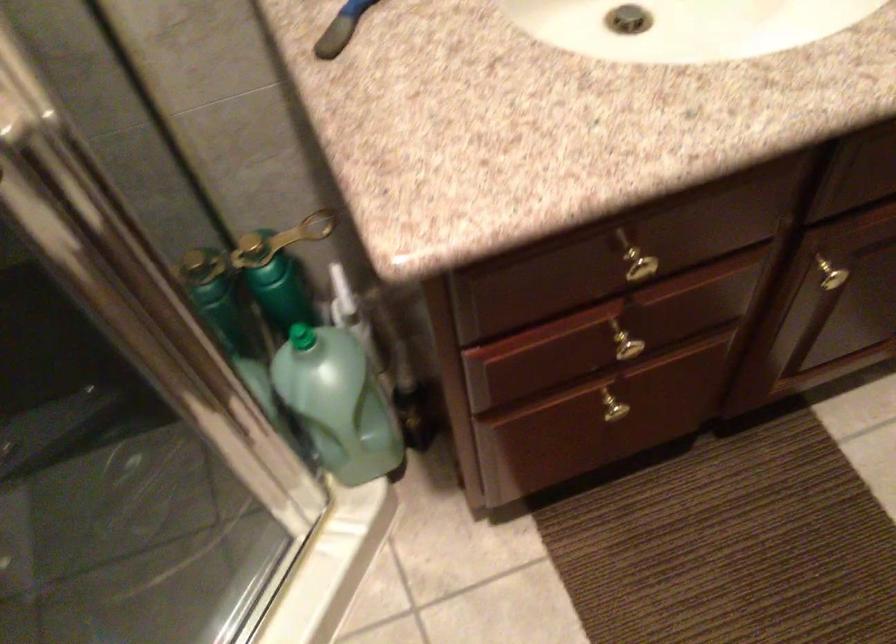
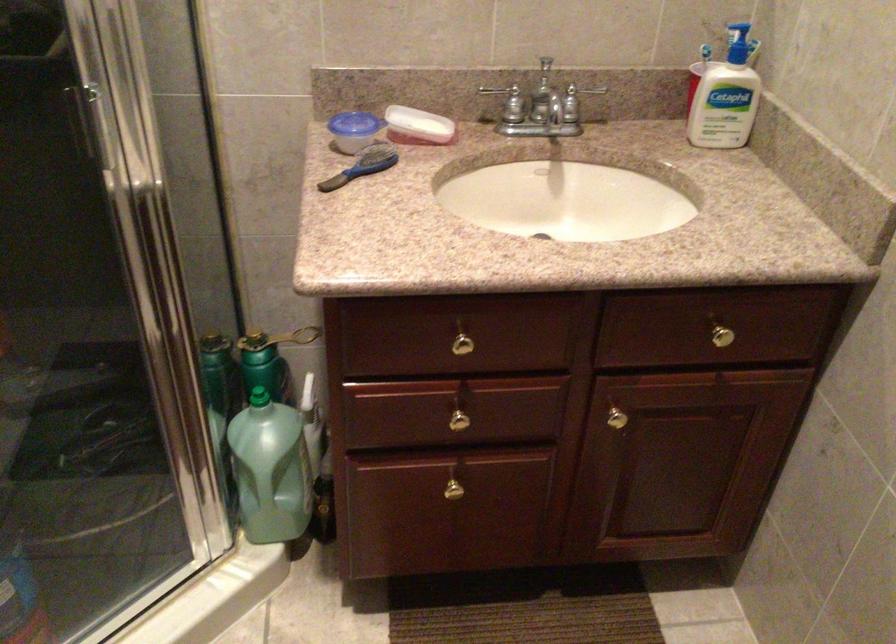
In the second image, find the point that corresponds to point 616,406 in the first image.

(455, 488)